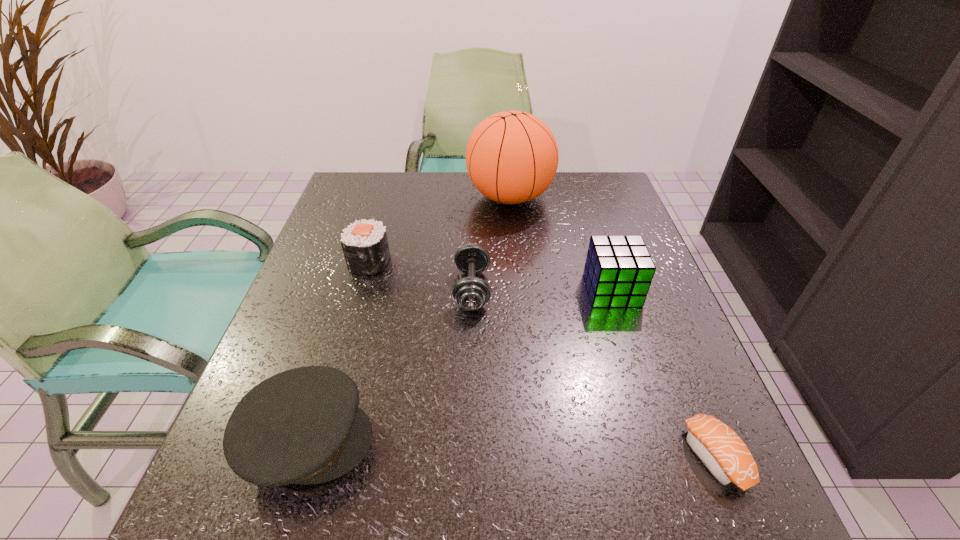
Where is `free space located 0.370m on the back of the cube`? free space located 0.370m on the back of the cube is located at coordinates (580, 188).

Find the location of a particular element. The width and height of the screenshot is (960, 540). free location located on the right of the farther sushi is located at coordinates (558, 262).

This screenshot has width=960, height=540. I want to click on vacant position located on the front-facing side of the beret, so click(x=492, y=440).

The width and height of the screenshot is (960, 540). What are the coordinates of `vacant space situated on the front of the second shortest object` in the screenshot? It's located at (469, 426).

Where is `free space located on the left of the shorter sushi`? This screenshot has width=960, height=540. free space located on the left of the shorter sushi is located at coordinates (586, 456).

Locate an element on the screen. Image resolution: width=960 pixels, height=540 pixels. object positioned at the far edge is located at coordinates (512, 157).

Where is `beret situated at the near edge`? beret situated at the near edge is located at coordinates (303, 426).

Image resolution: width=960 pixels, height=540 pixels. I want to click on sushi at the near edge, so click(720, 449).

Where is `sushi at the left edge`? Image resolution: width=960 pixels, height=540 pixels. sushi at the left edge is located at coordinates (365, 246).

You are a GUI agent. You are given a task and a screenshot of the screen. Output one action in this format:
    pyautogui.click(x=<x>, y=<y>)
    Task: Click on the beret that is at the left edge
    The image size is (960, 540).
    Given the screenshot: What is the action you would take?
    pyautogui.click(x=303, y=426)